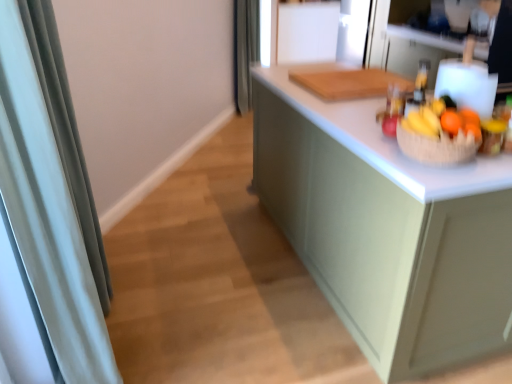
Question: Is matte green cabinet at center to the left of brown woven basket at right from the viewer's perspective?

Choices:
 (A) yes
 (B) no

Answer: (A)

Question: From the image's perspective, is matte green cabinet at center beneath brown woven basket at right?

Choices:
 (A) no
 (B) yes

Answer: (B)

Question: Does matte green cabinet at center come in front of brown woven basket at right?

Choices:
 (A) yes
 (B) no

Answer: (A)

Question: Can you confirm if matte green cabinet at center is wider than brown woven basket at right?

Choices:
 (A) no
 (B) yes

Answer: (B)

Question: Is matte green cabinet at center at the right side of brown woven basket at right?

Choices:
 (A) yes
 (B) no

Answer: (B)

Question: Considering the positions of translucent glass bottle at upper right and gray fabric shower curtain at upper center, marked as the second shower curtain in a bottom-to-top arrangement, in the image, is translucent glass bottle at upper right taller or shorter than gray fabric shower curtain at upper center, marked as the second shower curtain in a bottom-to-top arrangement,?

Choices:
 (A) short
 (B) tall

Answer: (A)

Question: In terms of size, does translucent glass bottle at upper right appear bigger or smaller than gray fabric shower curtain at upper center, the 1th shower curtain when ordered from top to bottom?

Choices:
 (A) small
 (B) big

Answer: (A)

Question: From a real-world perspective, is translucent glass bottle at upper right above or below gray fabric shower curtain at upper center, which is the 1th shower curtain from right to left?

Choices:
 (A) above
 (B) below

Answer: (A)

Question: Based on their positions, is translucent glass bottle at upper right located to the left or right of gray fabric shower curtain at upper center, marked as the 2th shower curtain in a left-to-right arrangement?

Choices:
 (A) right
 (B) left

Answer: (A)

Question: From a real-world perspective, is satin fabric shower curtain at left, placed as the second shower curtain when sorted from back to front, physically located above or below matte green cabinet at center?

Choices:
 (A) below
 (B) above

Answer: (B)

Question: In terms of height, does satin fabric shower curtain at left, the second shower curtain positioned from the right, look taller or shorter compared to matte green cabinet at center?

Choices:
 (A) tall
 (B) short

Answer: (A)

Question: Based on their positions, is satin fabric shower curtain at left, placed as the 1th shower curtain when sorted from front to back, located to the left or right of matte green cabinet at center?

Choices:
 (A) right
 (B) left

Answer: (B)

Question: From the image's perspective, is satin fabric shower curtain at left, placed as the second shower curtain when sorted from back to front, located above or below matte green cabinet at center?

Choices:
 (A) above
 (B) below

Answer: (B)

Question: Do you think translucent glass bottle at upper right is within satin fabric shower curtain at left, which appears as the first shower curtain when viewed from the left, or outside of it?

Choices:
 (A) inside
 (B) outside

Answer: (B)

Question: Is translucent glass bottle at upper right wider or thinner than satin fabric shower curtain at left, which appears as the first shower curtain when viewed from the left?

Choices:
 (A) thin
 (B) wide

Answer: (A)